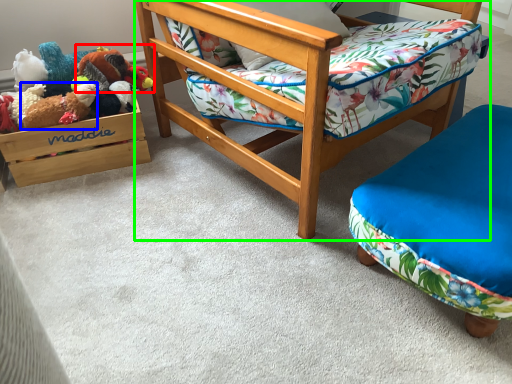
Question: Based on their relative distances, which object is nearer to toy (highlighted by a red box)? Choose from toy (highlighted by a blue box) and chair (highlighted by a green box).

Choices:
 (A) toy
 (B) chair

Answer: (A)